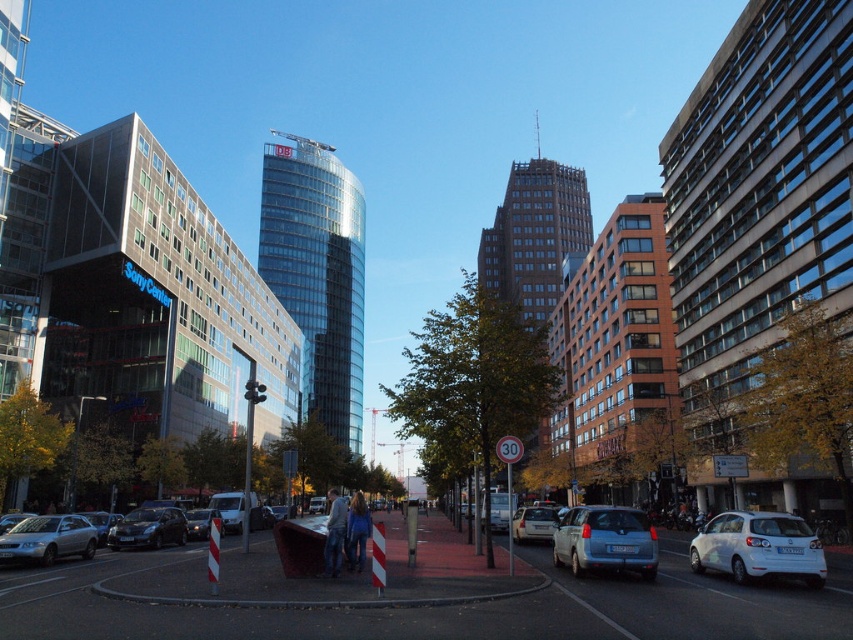
Question: Among these points, which one is nearest to the camera?

Choices:
 (A) (166, 536)
 (B) (347, 289)
 (C) (647, 548)

Answer: (C)

Question: Is silver metallic sedan at lower left to the left of silver metallic sedan at center from the viewer's perspective?

Choices:
 (A) yes
 (B) no

Answer: (A)

Question: Estimate the real-world distances between objects in this image. Which object is closer to the white matte hatchback at lower right?

Choices:
 (A) silver metallic sedan at center
 (B) transparent glass tower at center

Answer: (A)

Question: Is blue metallic van at center above shiny silver sedan at lower left?

Choices:
 (A) no
 (B) yes

Answer: (B)

Question: Among these points, which one is farthest from the camera?

Choices:
 (A) (192, 538)
 (B) (15, 556)
 (C) (604, 548)
 (D) (129, 531)

Answer: (A)

Question: Is blue metallic van at center to the right of silver metallic sedan at lower left from the viewer's perspective?

Choices:
 (A) yes
 (B) no

Answer: (A)